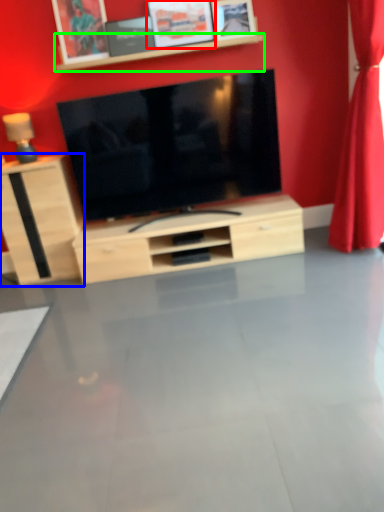
Question: Which object is positioned farthest from picture frame (highlighted by a red box)? Select from cabinetry (highlighted by a blue box) and shelf (highlighted by a green box).

Choices:
 (A) cabinetry
 (B) shelf

Answer: (A)